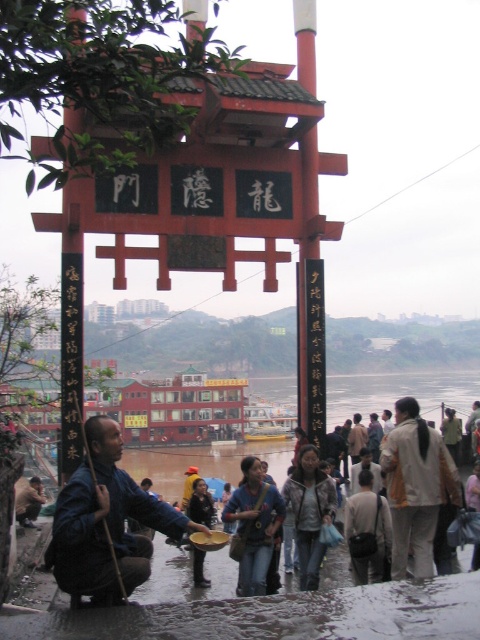
Which is in front, point (128, 548) or point (440, 496)?

Point (128, 548) is in front.

This screenshot has width=480, height=640. What are the coordinates of `blue fabric man at lower left` in the screenshot? It's located at (106, 522).

Is blue fabric man at lower left to the left of brown leather jacket at lower left from the viewer's perspective?

No, blue fabric man at lower left is not to the left of brown leather jacket at lower left.

Is blue fabric man at lower left shorter than brown leather jacket at lower left?

No.

Is point (83, 532) closer to viewer compared to point (26, 515)?

That is True.

I want to click on blue fabric man at lower left, so click(x=106, y=522).

What do you see at coordinates (416, 486) in the screenshot? The height and width of the screenshot is (640, 480). I see `olive-green fabric jacket at lower right` at bounding box center [416, 486].

Is point (403, 541) positioned in front of point (35, 513)?

Yes.

Is point (384, 461) behind point (31, 481)?

That is False.

The width and height of the screenshot is (480, 640). What are the coordinates of `olive-green fabric jacket at lower right` in the screenshot? It's located at (416, 486).